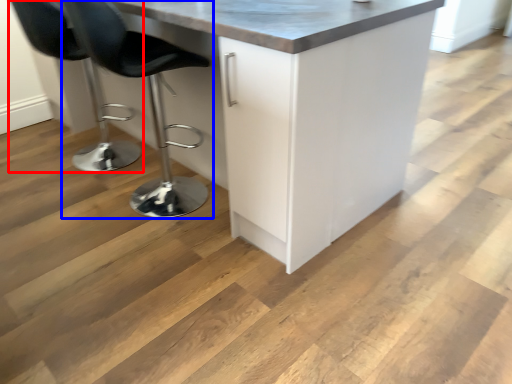
Question: Among these objects, which one is farthest to the camera, chair (highlighted by a red box) or chair (highlighted by a blue box)?

Choices:
 (A) chair
 (B) chair

Answer: (A)